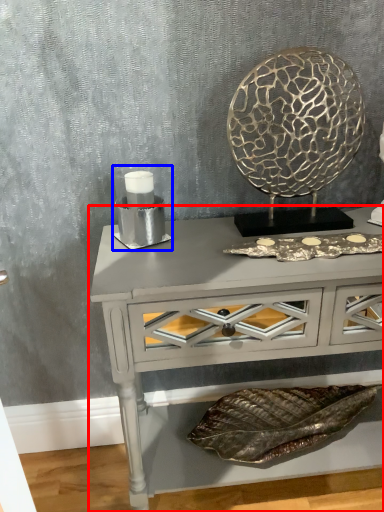
Question: Which point is closer to the camera, table (highlighted by a red box) or candle holder (highlighted by a blue box)?

Choices:
 (A) table
 (B) candle holder

Answer: (A)